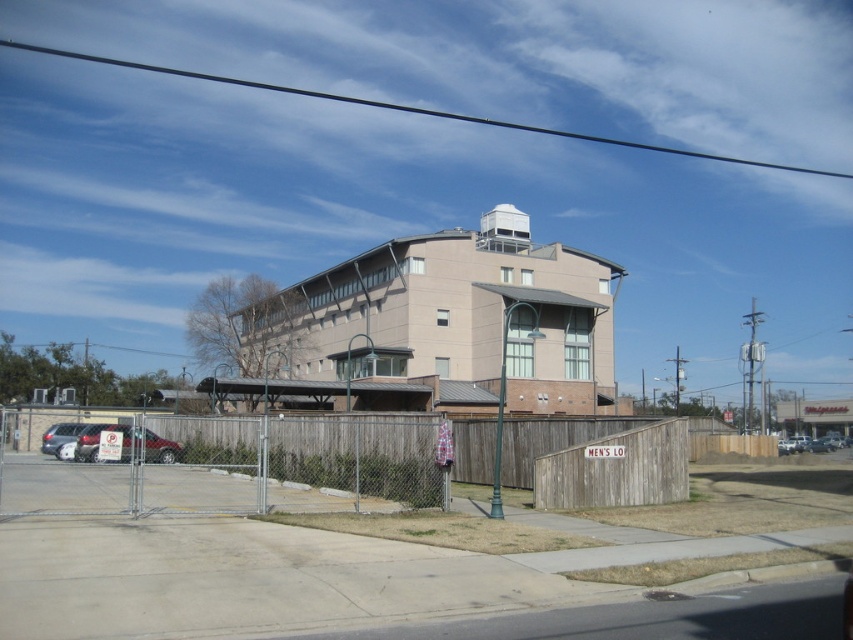
Question: Among these points, which one is farthest from the camera?

Choices:
 (A) (428, 467)
 (B) (96, 444)

Answer: (B)

Question: Does metal chain-link fence at lower center appear on the left side of matte silver car at left?

Choices:
 (A) no
 (B) yes

Answer: (B)

Question: Is metal chain-link fence at lower center further to camera compared to matte silver car at left?

Choices:
 (A) no
 (B) yes

Answer: (A)

Question: Which object appears farthest from the camera in this image?

Choices:
 (A) metal chain-link fence at lower center
 (B) silver metallic sedan at lower left
 (C) matte silver car at left

Answer: (B)

Question: Is matte silver car at left positioned at the back of silver metallic sedan at lower left?

Choices:
 (A) no
 (B) yes

Answer: (A)

Question: Estimate the real-world distances between objects in this image. Which object is farther from the silver metallic sedan at lower left?

Choices:
 (A) matte silver car at left
 (B) metal chain-link fence at lower center

Answer: (B)